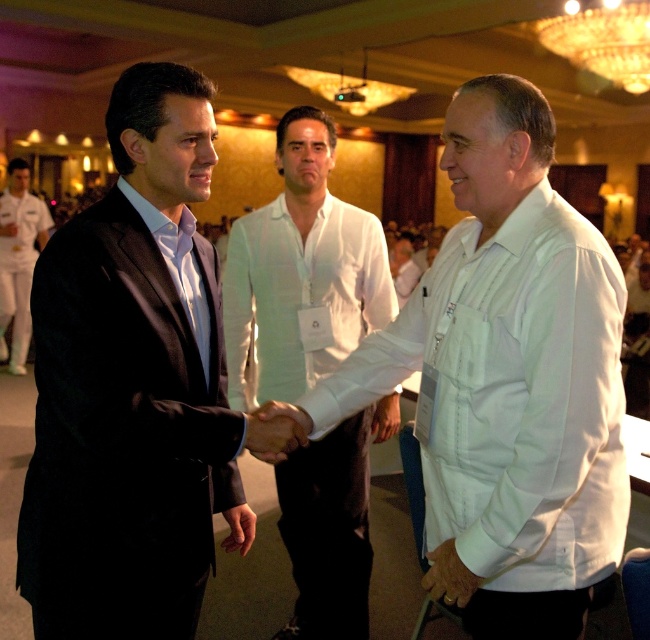
Does white textured shirt at center have a greater width compared to white cotton shirt at left?

Yes.

Where is `white textured shirt at center`? white textured shirt at center is located at coordinates (302, 269).

Identify the location of white textured shirt at center. The width and height of the screenshot is (650, 640). (302, 269).

Does white cotton shirt at center have a greater height compared to white cotton shirt at left?

No.

In order to click on white cotton shirt at center in this screenshot , I will do `click(507, 380)`.

The width and height of the screenshot is (650, 640). Identify the location of white cotton shirt at center. (507, 380).

Which is more to the right, matte black suit at left or white cotton shirt at left?

matte black suit at left

Between matte black suit at left and white cotton shirt at left, which one is positioned higher?

white cotton shirt at left

Is point (138, 209) in front of point (29, 204)?

That is True.

At what (x,y) coordinates should I click in order to perform the action: click on matte black suit at left. Please return your answer as a coordinate pair (x, y). The height and width of the screenshot is (640, 650). Looking at the image, I should click on (135, 387).